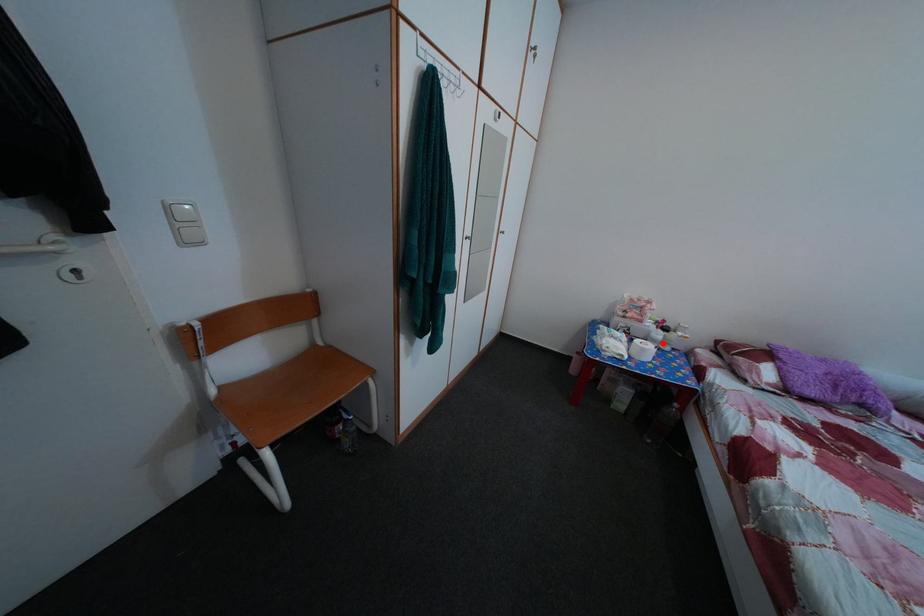
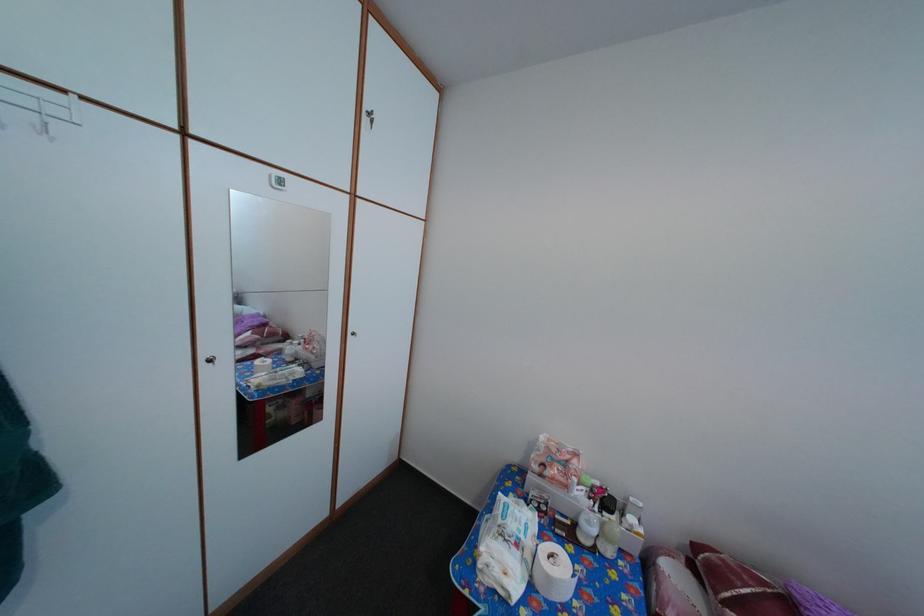
Question: A red point is marked in image1. In image2, is the corresponding 3D point closer to the camera or farther? Reply with the corresponding letter.

Choices:
 (A) The corresponding 3D point is closer.
 (B) The corresponding 3D point is farther.

Answer: (B)